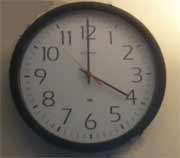
The width and height of the screenshot is (180, 158). I want to click on wall clock is on, so click(x=146, y=144).